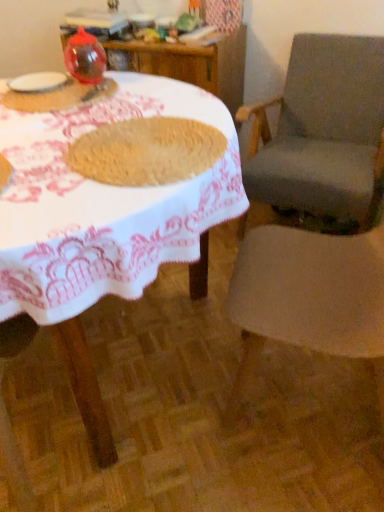
Where is `free location to the right of white matte plate at upper left, marked as the 2th tableware in a bottom-to-top arrangement`? free location to the right of white matte plate at upper left, marked as the 2th tableware in a bottom-to-top arrangement is located at coordinates (93, 92).